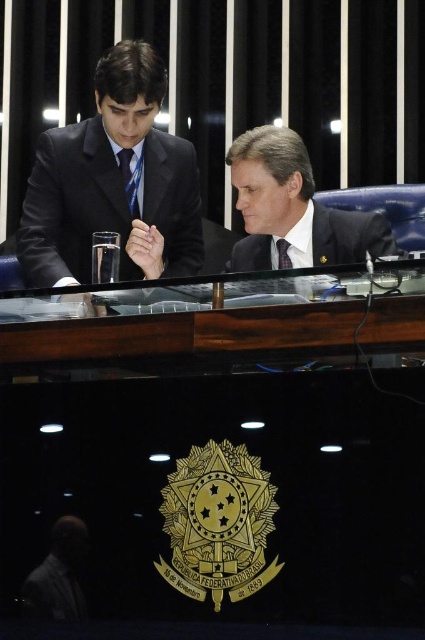
Which is above, matte black suit at left or matte blue tie at center?

matte black suit at left is above.

Measure the distance between matte black suit at left and matte blue tie at center.

A distance of 22.33 inches exists between matte black suit at left and matte blue tie at center.

Which is in front, point (71, 150) or point (280, 253)?

Positioned in front is point (280, 253).

This screenshot has height=640, width=425. I want to click on matte black suit at left, so click(113, 182).

Consider the image. Which is below, blue silk tie at left or matte blue tie at center?

matte blue tie at center

From the picture: Does blue silk tie at left appear over matte blue tie at center?

Yes.

Does point (124, 193) lie behind point (291, 266)?

Yes.

The width and height of the screenshot is (425, 640). Identify the location of blue silk tie at left. (130, 179).

Does dark matte suit at lower left have a greater height compared to blue silk tie at left?

Yes, dark matte suit at lower left is taller than blue silk tie at left.

Which of these two, dark matte suit at lower left or blue silk tie at left, stands shorter?

blue silk tie at left is shorter.

This screenshot has width=425, height=640. I want to click on dark matte suit at lower left, so 59,573.